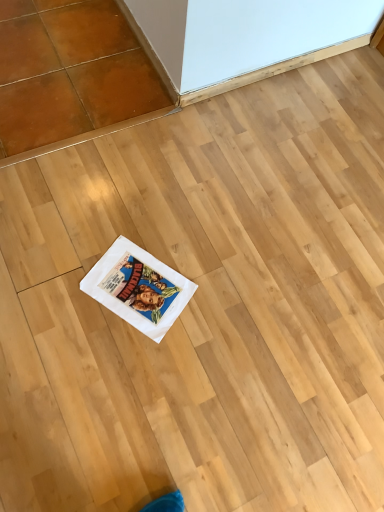
Where is `vacant area that lies to the right of white paper comic book at center`? vacant area that lies to the right of white paper comic book at center is located at coordinates (220, 306).